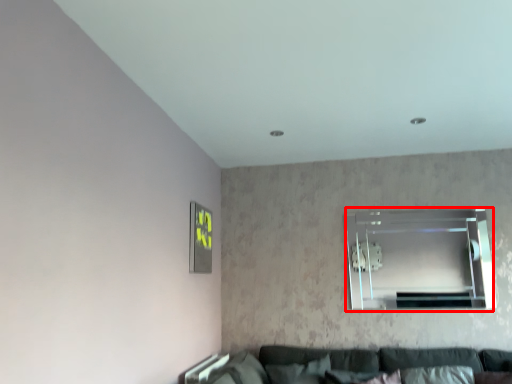
Question: Considering the relative positions of window (annotated by the red box) and picture frame in the image provided, where is window (annotated by the red box) located with respect to the staircase?

Choices:
 (A) right
 (B) left

Answer: (A)